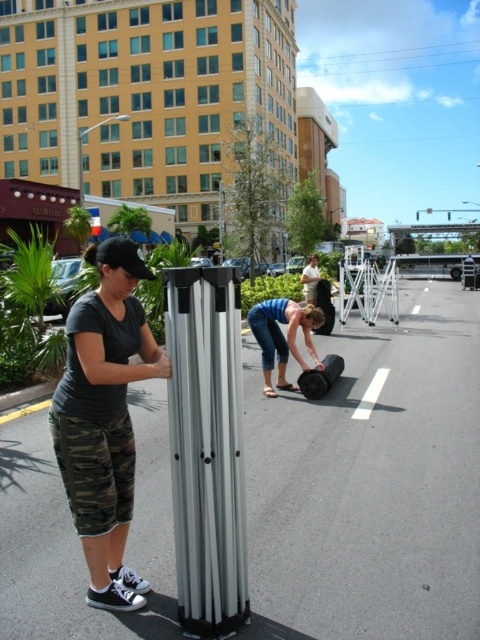
Question: Among these objects, which one is farthest from the camera?

Choices:
 (A) white matte shirt at center
 (B) blue denim jeans at lower center
 (C) camo pants at lower left

Answer: (A)

Question: Which object is farther from the camera taking this photo?

Choices:
 (A) blue denim jeans at lower center
 (B) camo pants at lower left
 (C) white matte shirt at center

Answer: (C)

Question: Can you confirm if camo pants at lower left is positioned to the right of blue denim jeans at lower center?

Choices:
 (A) no
 (B) yes

Answer: (A)

Question: Is blue denim jeans at lower center to the right of white matte shirt at center from the viewer's perspective?

Choices:
 (A) no
 (B) yes

Answer: (A)

Question: Does blue denim jeans at lower center have a smaller size compared to white matte shirt at center?

Choices:
 (A) yes
 (B) no

Answer: (A)

Question: Which of the following is the farthest from the observer?

Choices:
 (A) white matte shirt at center
 (B) blue denim jeans at lower center

Answer: (A)